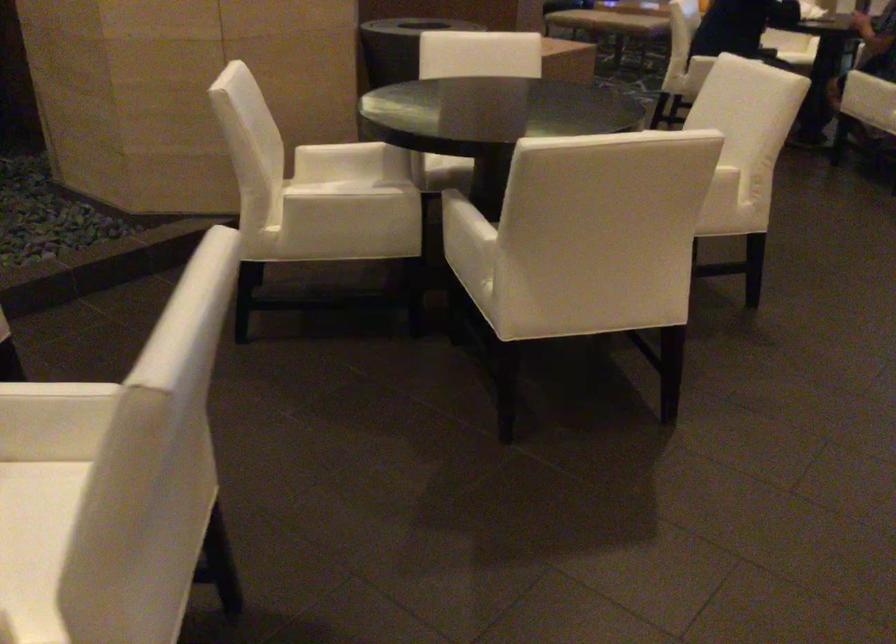
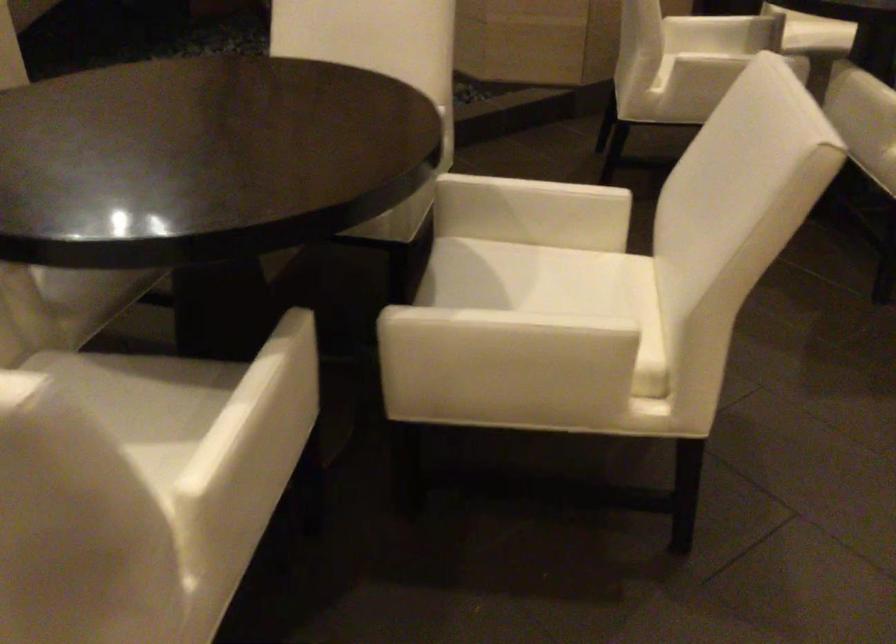
Locate, in the second image, the point that corresponds to point 314,185 in the first image.

(687, 43)